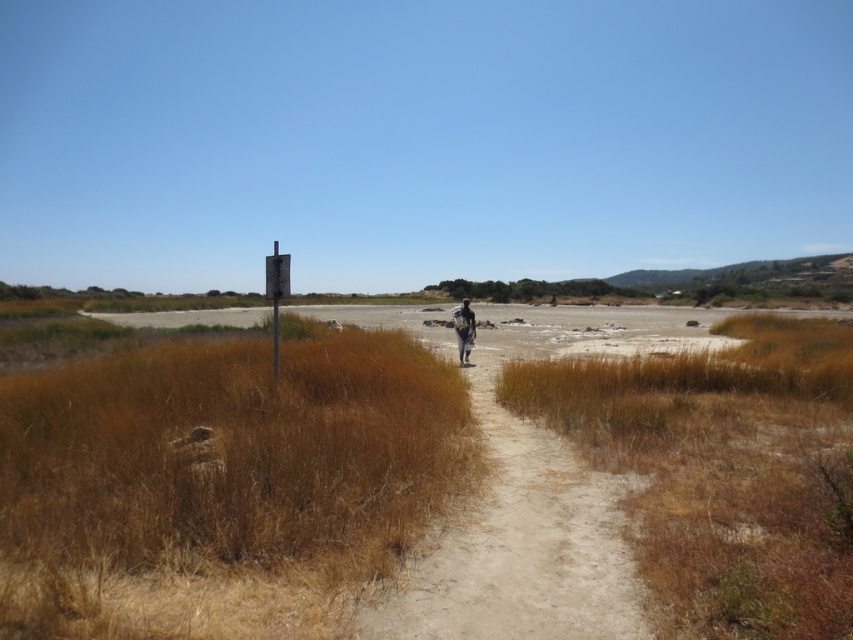
You are an explorer in the desert and see the brown dry grass at lower left and the dark blue fabric at center. Which object is bigger in size?

The brown dry grass at lower left has a larger size compared to the dark blue fabric at center, so the brown dry grass at lower left is bigger.

You are hiking along the dirt path and need to decide whether to take a shortcut through the brown dry grass at lower left or the dark blue fabric at center. Which path has shorter obstacles?

The brown dry grass at lower left is not as tall as the dark blue fabric at center, so the brown dry grass at lower left has shorter obstacles.

You are a hiker carrying a dark blue fabric at center and need to cross the sandy area. There is a narrow dirt path with brown dry grass at lower left. Which direction should you move to stay on the path while avoiding the sandy area?

The brown dry grass at lower left is positioned on the left side of dark blue fabric at center. To stay on the path and avoid the sandy area, move towards the left side of the dark blue fabric at center where the brown dry grass is located, as the path is likely there.